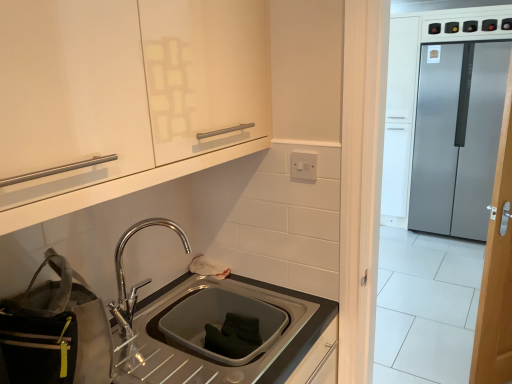
Question: Should I look upward or downward to see white plastic electric outlet at upper center?

Choices:
 (A) up
 (B) down

Answer: (A)

Question: From the image's perspective, does wooden door at right appear lower than satin silver refrigerator at right?

Choices:
 (A) yes
 (B) no

Answer: (A)

Question: Can you confirm if wooden door at right is shorter than satin silver refrigerator at right?

Choices:
 (A) yes
 (B) no

Answer: (B)

Question: Can you confirm if wooden door at right is positioned to the right of satin silver refrigerator at right?

Choices:
 (A) yes
 (B) no

Answer: (B)

Question: Is wooden door at right touching satin silver refrigerator at right?

Choices:
 (A) no
 (B) yes

Answer: (A)

Question: Are wooden door at right and satin silver refrigerator at right far apart?

Choices:
 (A) yes
 (B) no

Answer: (A)

Question: Is wooden door at right outside of satin silver refrigerator at right?

Choices:
 (A) no
 (B) yes

Answer: (B)

Question: Considering the relative sizes of satin steel sink at lower center and gray fabric bag at lower left in the image provided, is satin steel sink at lower center bigger than gray fabric bag at lower left?

Choices:
 (A) yes
 (B) no

Answer: (A)

Question: From the image's perspective, is satin steel sink at lower center below gray fabric bag at lower left?

Choices:
 (A) no
 (B) yes

Answer: (B)

Question: Is satin steel sink at lower center completely or partially outside of gray fabric bag at lower left?

Choices:
 (A) yes
 (B) no

Answer: (A)

Question: Is satin steel sink at lower center oriented away from gray fabric bag at lower left?

Choices:
 (A) yes
 (B) no

Answer: (B)

Question: Could you tell me if satin steel sink at lower center is facing gray fabric bag at lower left?

Choices:
 (A) yes
 (B) no

Answer: (B)

Question: From a real-world perspective, is satin steel sink at lower center on gray fabric bag at lower left?

Choices:
 (A) yes
 (B) no

Answer: (B)

Question: Is satin steel sink at lower center in front of polished chrome tap at lower center?

Choices:
 (A) no
 (B) yes

Answer: (B)